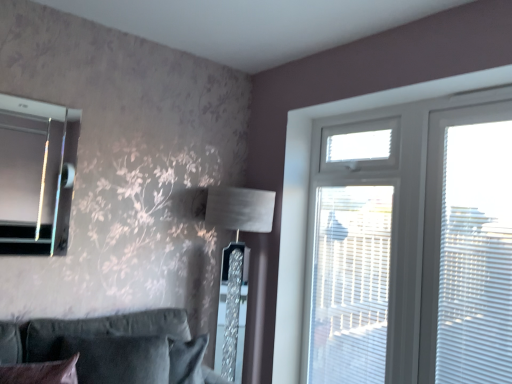
Question: From their relative heights in the image, would you say white plastic blinds at right is taller or shorter than matte glass bay window at upper left?

Choices:
 (A) short
 (B) tall

Answer: (B)

Question: Considering the positions of white plastic blinds at right and matte glass bay window at upper left in the image, is white plastic blinds at right wider or thinner than matte glass bay window at upper left?

Choices:
 (A) thin
 (B) wide

Answer: (A)

Question: Based on their relative distances, which object is nearer to the white plastic screen door at upper right?

Choices:
 (A) matte glass bay window at upper left
 (B) suede-like dark green couch at lower left
 (C) white plastic window at upper right
 (D) satin silver lampshade at center
 (E) velvet dark brown pillow at lower left

Answer: (C)

Question: Based on their relative distances, which object is farther from the white plastic screen door at upper right?

Choices:
 (A) satin silver lampshade at center
 (B) suede-like dark green couch at lower left
 (C) white plastic blinds at right
 (D) velvet dark brown pillow at lower left
 (E) white plastic window at upper right

Answer: (D)